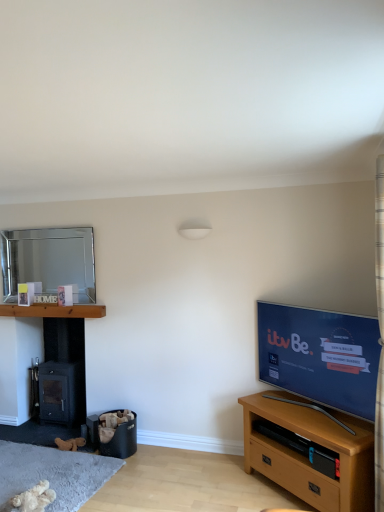
Locate an element on the screen. The image size is (384, 512). free space in front of black plastic trash bin at lower left is located at coordinates (140, 468).